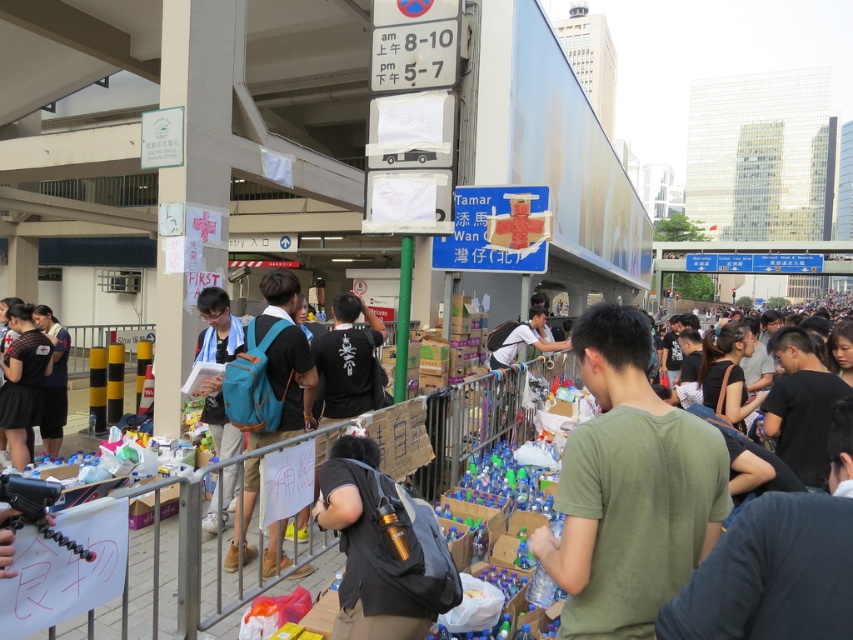
Question: Among these points, which one is farthest from the camera?

Choices:
 (A) (625, 624)
 (B) (39, 410)

Answer: (B)

Question: Estimate the real-world distances between objects in this image. Which object is closer to the green matte shirt at center?

Choices:
 (A) dark gray fabric shirt at left
 (B) dark blue backpack at left
 (C) teal fabric backpack at center

Answer: (C)

Question: In this image, where is matte blue backpack at center located relative to dark gray fabric shirt at left?

Choices:
 (A) left
 (B) right

Answer: (B)

Question: Does matte blue backpack at center have a larger size compared to dark gray fabric shirt at left?

Choices:
 (A) yes
 (B) no

Answer: (B)

Question: Which point appears farthest from the camera in this image?

Choices:
 (A) (47, 326)
 (B) (502, 332)
 (C) (647, 381)
 (D) (15, 349)

Answer: (B)

Question: Does metallic gold water bottle at center have a smaller size compared to matte blue backpack at center?

Choices:
 (A) no
 (B) yes

Answer: (B)